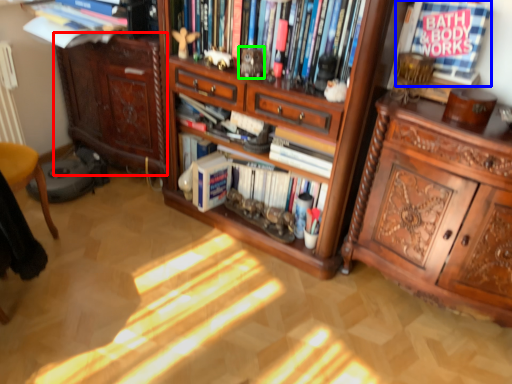
Question: Considering the real-world distances, which object is farthest from cabinetry (highlighted by a red box)? book (highlighted by a blue box) or toy (highlighted by a green box)?

Choices:
 (A) book
 (B) toy

Answer: (A)